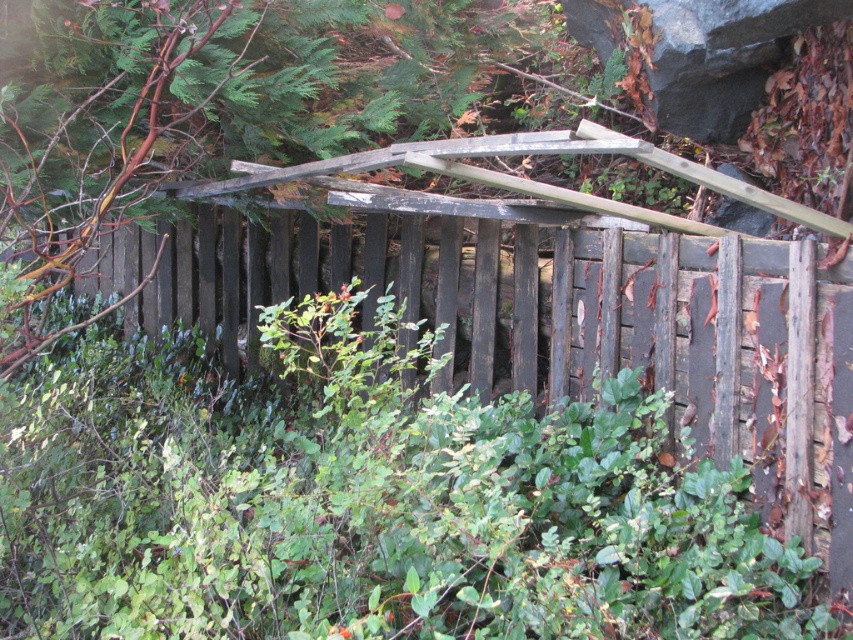
You are standing in a forest and see the weathered wood fence at center and the gray rock at upper right. Which object is closer to the left side of your view?

The weathered wood fence at center is to the left of the gray rock at upper right, so it is closer to the left side of your view.

You are standing in front of the rustic wooden structure and notice the weathered wood fence at center and the gray rock at upper right. Which object is nearer to you?

The weathered wood fence at center is closer to the viewer than the gray rock at upper right.

You are standing in a forest clearing and see the weathered wood fence at center. If you want to locate it precisely, what are its coordinates?

The weathered wood fence at center is located at coordinates point (560, 323).